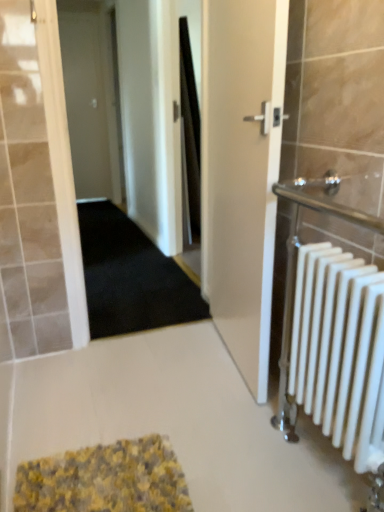
Question: Considering the relative sizes of black carpet at center and white matte radiator at right in the image provided, is black carpet at center wider than white matte radiator at right?

Choices:
 (A) no
 (B) yes

Answer: (B)

Question: Is black carpet at center at the right side of white matte radiator at right?

Choices:
 (A) no
 (B) yes

Answer: (A)

Question: Is black carpet at center positioned far away from white matte radiator at right?

Choices:
 (A) no
 (B) yes

Answer: (B)

Question: From the image's perspective, is black carpet at center below white matte radiator at right?

Choices:
 (A) yes
 (B) no

Answer: (B)

Question: From the image's perspective, is black carpet at center on top of white matte radiator at right?

Choices:
 (A) yes
 (B) no

Answer: (A)

Question: From a real-world perspective, is black carpet at center under white matte radiator at right?

Choices:
 (A) no
 (B) yes

Answer: (B)

Question: Is the position of white glossy door at center, arranged as the first door when viewed from the front, more distant than that of yellow textured bath mat at lower center?

Choices:
 (A) no
 (B) yes

Answer: (B)

Question: From the image's perspective, does white glossy door at center, the second door positioned from the top, appear higher than yellow textured bath mat at lower center?

Choices:
 (A) no
 (B) yes

Answer: (B)

Question: Can you confirm if white glossy door at center, arranged as the first door when viewed from the front, is thinner than yellow textured bath mat at lower center?

Choices:
 (A) no
 (B) yes

Answer: (B)

Question: From the image's perspective, is white glossy door at center, the first door in the bottom-to-top sequence, below yellow textured bath mat at lower center?

Choices:
 (A) yes
 (B) no

Answer: (B)

Question: Is white glossy door at center, arranged as the first door when viewed from the front, smaller than yellow textured bath mat at lower center?

Choices:
 (A) yes
 (B) no

Answer: (B)

Question: Is white glossy door at center, the 2th door from the back, next to yellow textured bath mat at lower center?

Choices:
 (A) no
 (B) yes

Answer: (A)

Question: Is white glossy door at center, which ranks as the 2th door in left-to-right order, in contact with white matte door at upper left, the 2th door positioned from the right?

Choices:
 (A) yes
 (B) no

Answer: (B)